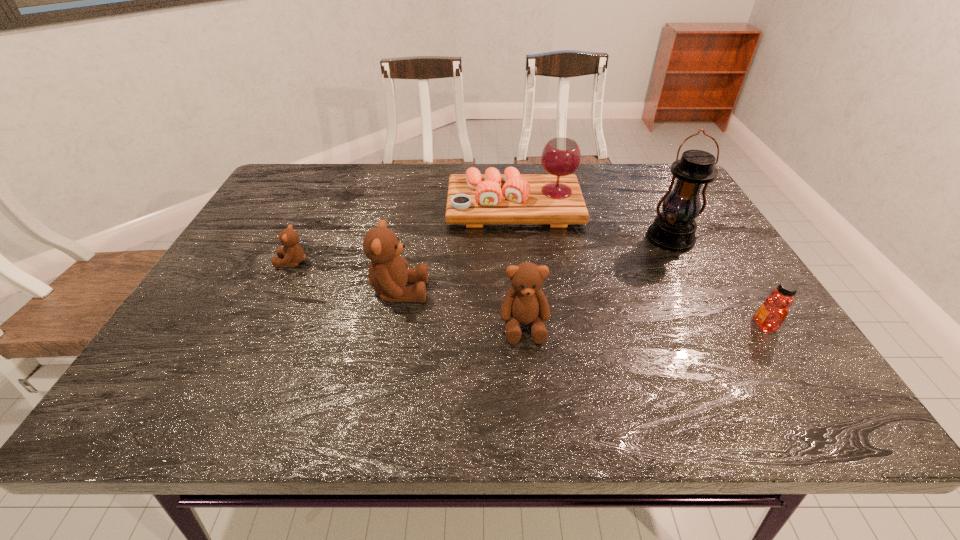
Where is `the leftmost teddy bear`? the leftmost teddy bear is located at coordinates (292, 254).

In order to click on the leftmost object in this screenshot , I will do `click(292, 254)`.

Find the location of a particular element. the second teddy bear from left to right is located at coordinates (388, 276).

This screenshot has height=540, width=960. Identify the location of the rightmost teddy bear. (525, 303).

Locate an element on the screen. This screenshot has width=960, height=540. the second tallest teddy bear is located at coordinates (525, 303).

Identify the location of the fifth object from left to right. (674, 229).

Locate an element on the screen. Image resolution: width=960 pixels, height=540 pixels. the tallest object is located at coordinates (674, 229).

I want to click on platter, so click(x=474, y=199).

Locate an element on the screen. honey is located at coordinates (772, 313).

Image resolution: width=960 pixels, height=540 pixels. What are the coordinates of `vacant space located 0.100m on the face of the leftmost object` in the screenshot? It's located at (237, 262).